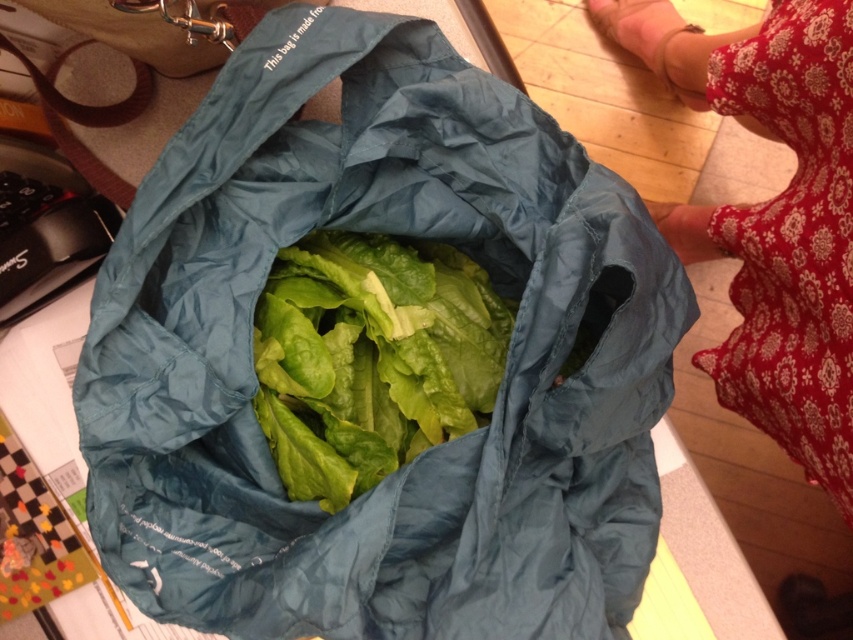
Looking at this image, you are organizing items in a room and notice the teal fabric bag at center and the red floral dress at lower right. Which object is positioned lower in the scene?

The teal fabric bag at center is positioned below the red floral dress at lower right, so it is lower in the scene.

You are organizing a small picnic basket and need to decide whether the red floral dress at lower right and the green leafy lettuce at center can fit together. Based on their sizes, which one takes up more space?

The red floral dress at lower right has a larger size compared to the green leafy lettuce at center, so it takes up more space.

You have a teal fabric bag at center and green leafy lettuce at center in front of you. Which object is wider?

The teal fabric bag at center is wider than the green leafy lettuce at center.